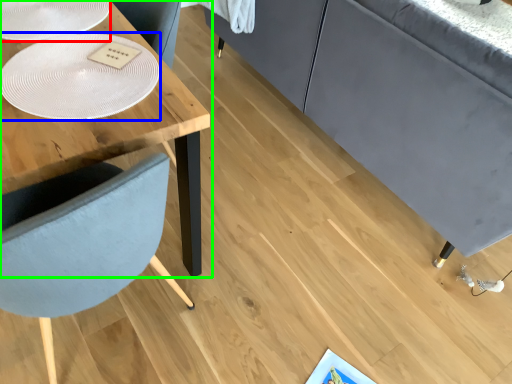
Question: Which is farther away from glass plate (highlighted by a red box)? glass plate (highlighted by a blue box) or table (highlighted by a green box)?

Choices:
 (A) glass plate
 (B) table

Answer: (A)